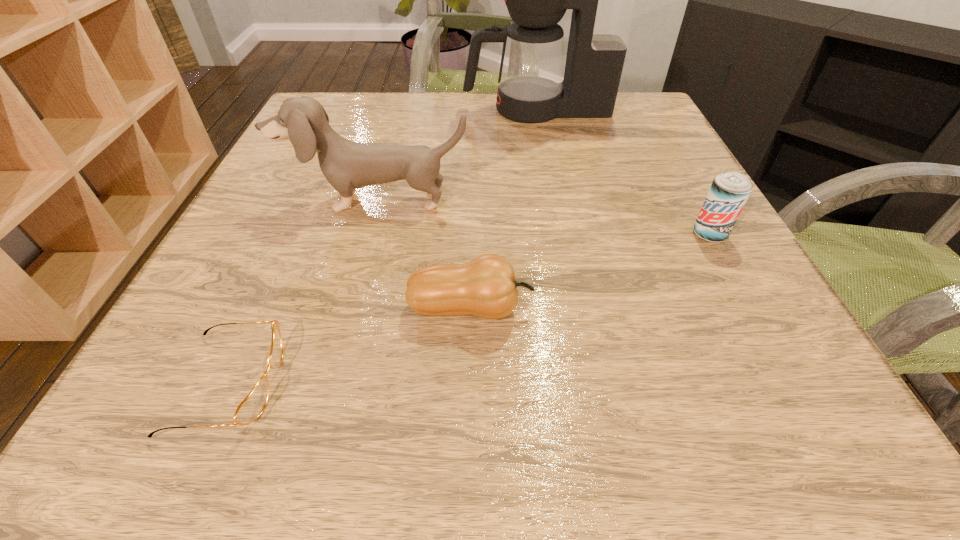
Identify the location of the tallest object. (x=531, y=89).

Where is `the farthest object`? The width and height of the screenshot is (960, 540). the farthest object is located at coordinates (531, 89).

The width and height of the screenshot is (960, 540). Find the location of `the second farthest object`. the second farthest object is located at coordinates (347, 165).

Identify the location of the second tallest object. The image size is (960, 540). (347, 165).

Identify the location of the rightmost object. The image size is (960, 540). (729, 192).

Where is `the third shortest object`? This screenshot has height=540, width=960. the third shortest object is located at coordinates (729, 192).

The width and height of the screenshot is (960, 540). I want to click on gourd, so click(x=486, y=287).

Find the location of a particular element. Image resolution: width=960 pixels, height=540 pixels. the fourth tallest object is located at coordinates (486, 287).

Locate an element on the screen. The width and height of the screenshot is (960, 540). spectacles is located at coordinates (252, 406).

This screenshot has height=540, width=960. Identify the location of the shortest object. (252, 406).